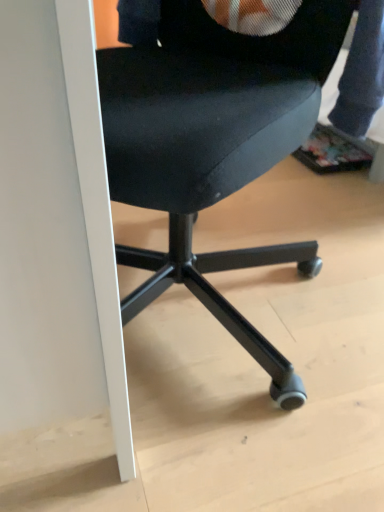
At what (x,y) coordinates should I click in order to perform the action: click on black leather chair at center. Please return your answer as a coordinate pair (x, y). Image resolution: width=384 pixels, height=512 pixels. Looking at the image, I should click on (213, 145).

The width and height of the screenshot is (384, 512). What do you see at coordinates (213, 145) in the screenshot? I see `black leather chair at center` at bounding box center [213, 145].

Locate an element on the screen. black leather chair at center is located at coordinates (213, 145).